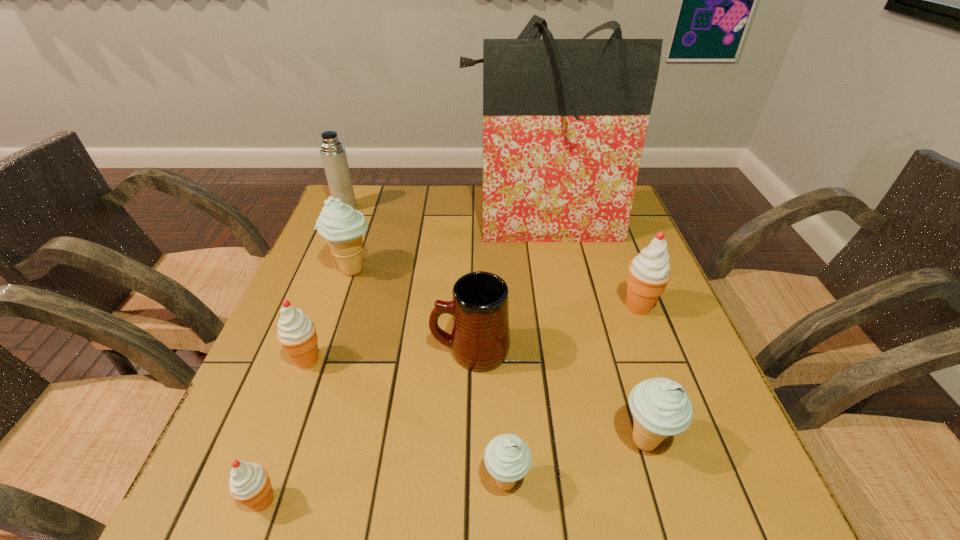
Identify the location of shopping bag. (564, 120).

You are a GUI agent. You are given a task and a screenshot of the screen. Output one action in this format:
    pyautogui.click(x=<x>, y=<y>)
    Task: Click on the tallest object
    This screenshot has height=540, width=960.
    Given the screenshot: What is the action you would take?
    pyautogui.click(x=564, y=120)

Image resolution: width=960 pixels, height=540 pixels. I want to click on thermos bottle, so click(333, 154).

The height and width of the screenshot is (540, 960). In order to click on the farthest beige icecream in this screenshot , I will do `click(342, 226)`.

You are a GUI agent. You are given a task and a screenshot of the screen. Output one action in this format:
    pyautogui.click(x=<x>, y=<y>)
    Task: Click on the farthest icecream
    The height and width of the screenshot is (540, 960).
    Given the screenshot: What is the action you would take?
    pyautogui.click(x=342, y=226)

The width and height of the screenshot is (960, 540). I want to click on the fourth farthest object, so click(649, 272).

Find the location of a particular element. the farthest red icecream is located at coordinates (649, 272).

At what (x,y) coordinates should I click in order to perform the action: click on mug. Please return your answer as a coordinate pair (x, y). The image size is (960, 540). Looking at the image, I should click on (480, 339).

Find the location of `the second smallest red icecream`. the second smallest red icecream is located at coordinates (296, 333).

The width and height of the screenshot is (960, 540). In order to click on the third farthest icecream in this screenshot , I will do `click(296, 333)`.